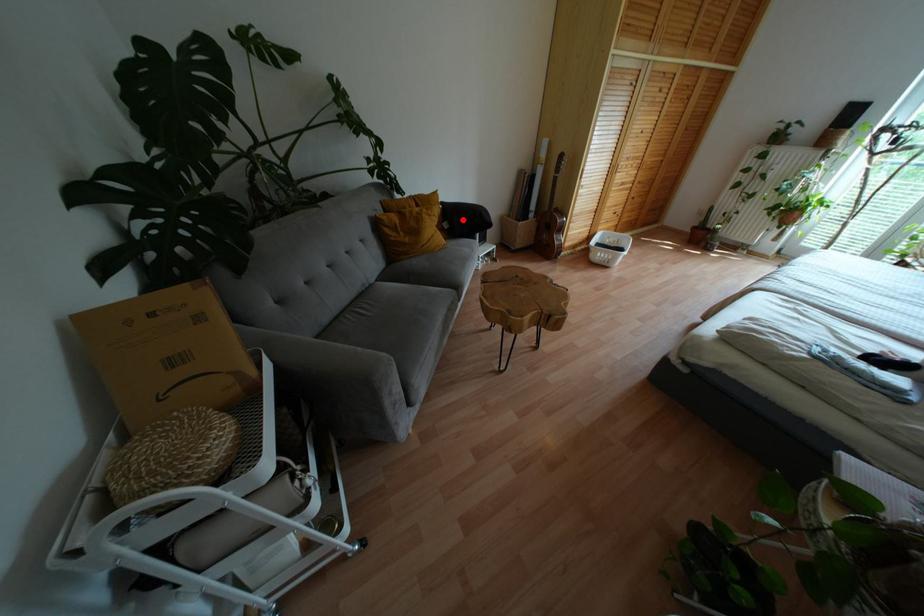
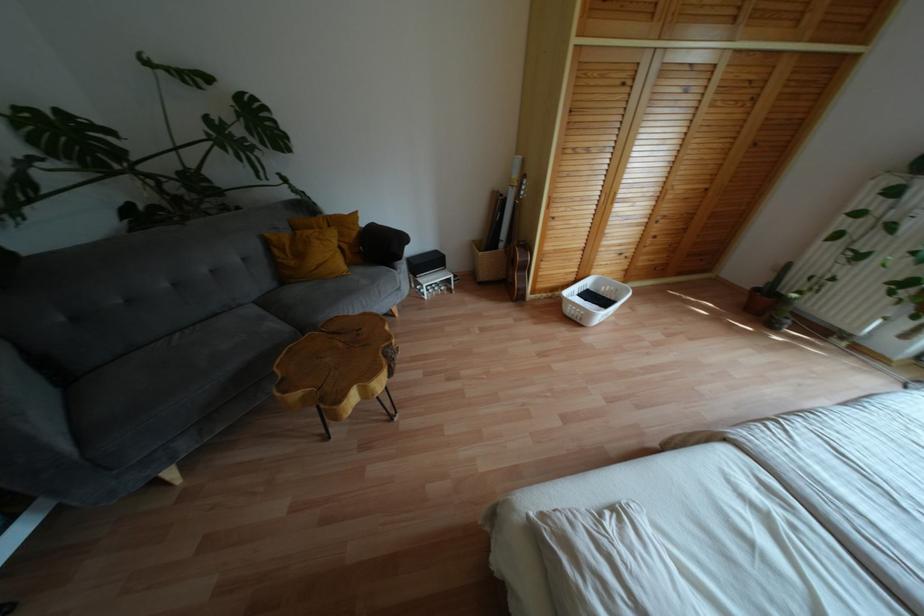
Find the pixel in the second image that matches the highlighted location in the first image.

(380, 246)